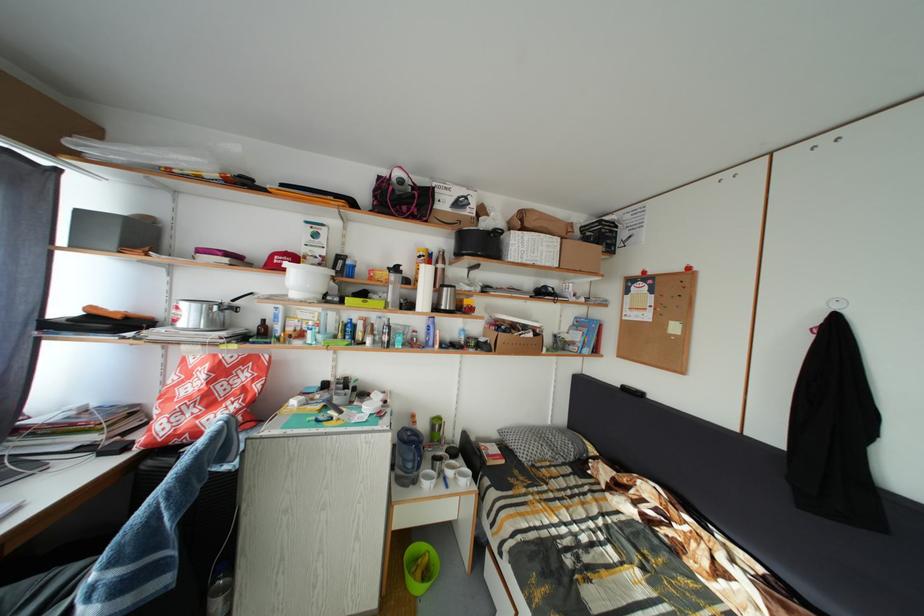
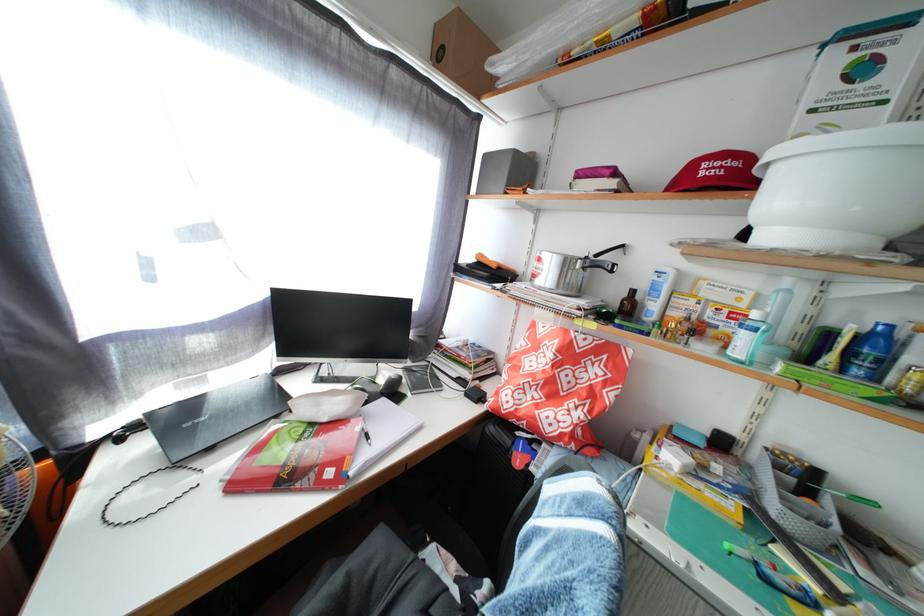
Find the pixel in the second image that matches [242,307] in the first image.

(605, 262)